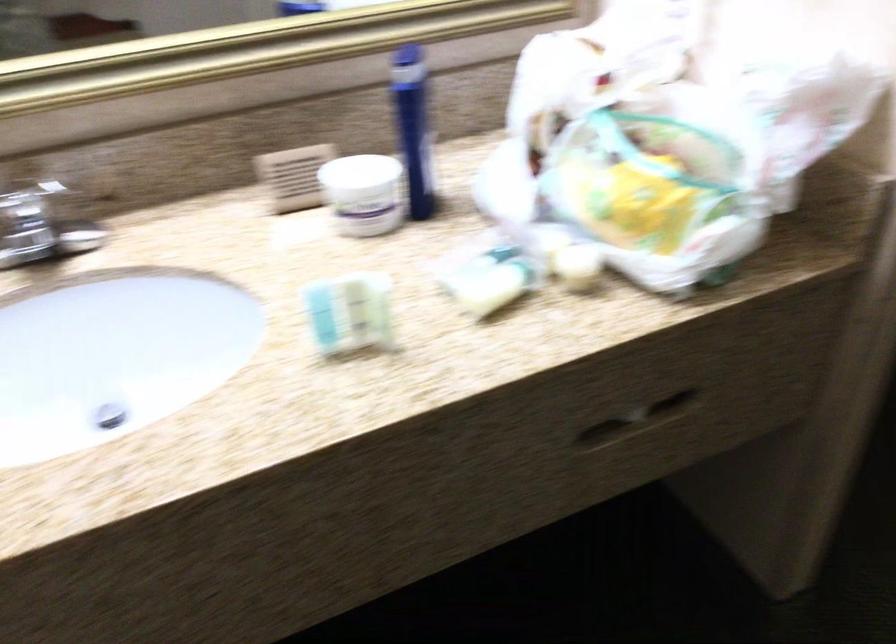
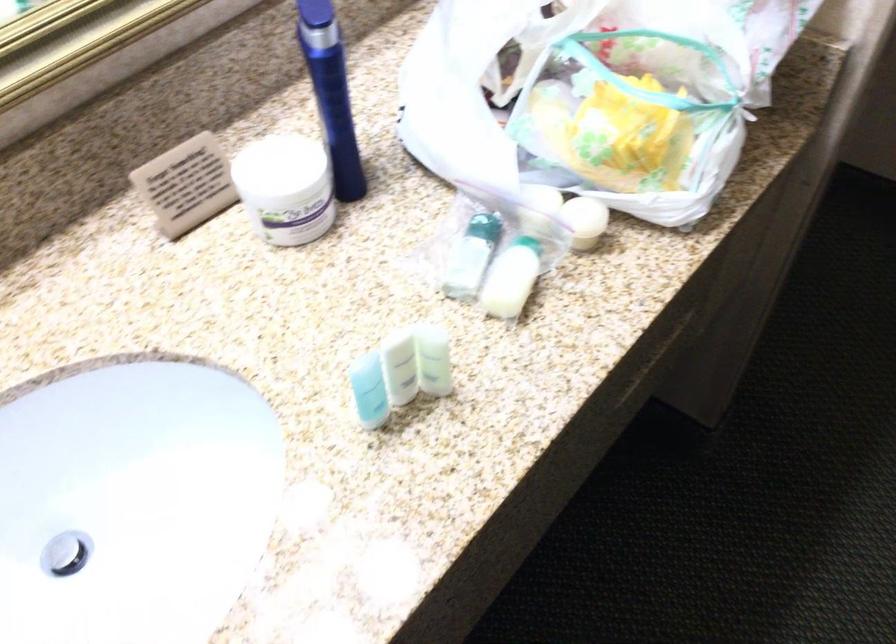
In the second image, find the point that corresponds to [350,305] in the first image.

(400, 368)